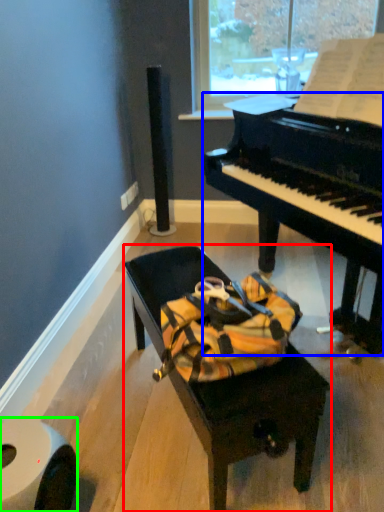
Question: Estimate the real-world distances between objects in this image. Which object is closer to furniture (highlighted by a red box), piano (highlighted by a blue box) or toilet paper (highlighted by a green box)?

Choices:
 (A) piano
 (B) toilet paper

Answer: (B)